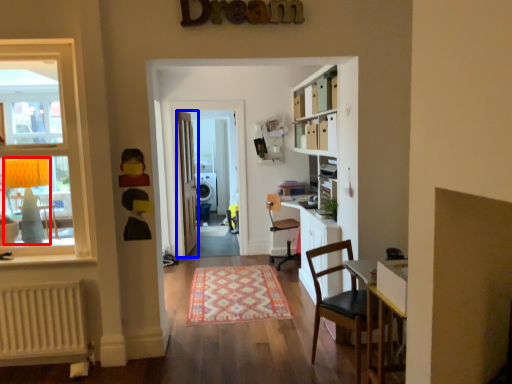
Question: Which point is closer to the camera, lamp (highlighted by a red box) or door (highlighted by a blue box)?

Choices:
 (A) lamp
 (B) door

Answer: (A)